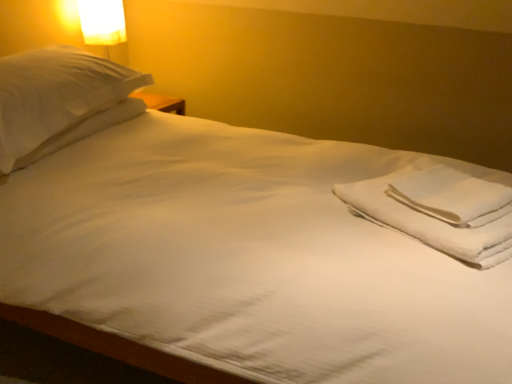
In the scene shown: What is the approximate width of matte white lampshade at upper left?

The width of matte white lampshade at upper left is 18.42 centimeters.

What do you see at coordinates (102, 22) in the screenshot? The height and width of the screenshot is (384, 512). I see `matte white lampshade at upper left` at bounding box center [102, 22].

The width and height of the screenshot is (512, 384). What are the coordinates of `white cotton towels at right` in the screenshot? It's located at coord(439,210).

Does matte white lampshade at upper left have a greater height compared to white soft pillow at upper left?

Indeed, matte white lampshade at upper left has a greater height compared to white soft pillow at upper left.

From the image's perspective, is matte white lampshade at upper left located above or below white soft pillow at upper left?

matte white lampshade at upper left is situated higher than white soft pillow at upper left in the image.

In the scene shown: In the image, is matte white lampshade at upper left positioned in front of or behind white soft pillow at upper left?

Visually, matte white lampshade at upper left is located behind white soft pillow at upper left.

How many degrees apart are the facing directions of matte white lampshade at upper left and white soft pillow at upper left?

The facing directions of matte white lampshade at upper left and white soft pillow at upper left are 130 degrees apart.

Is point (124, 75) behind point (123, 18)?

No, it is not.

From a real-world perspective, is white soft pillow at upper left above or below matte white lampshade at upper left?

white soft pillow at upper left is situated lower than matte white lampshade at upper left in the real world.

From the picture: Is white soft pillow at upper left at the left side of matte white lampshade at upper left?

No.

From the image's perspective, would you say white soft pillow at upper left is shown under matte white lampshade at upper left?

Indeed, from the image's perspective, white soft pillow at upper left is shown beneath matte white lampshade at upper left.

From the picture: Is white soft towel at right smaller than matte white lampshade at upper left?

Yes, white soft towel at right is smaller than matte white lampshade at upper left.

Between white soft towel at right and matte white lampshade at upper left, which one has less height?

With less height is white soft towel at right.

Is white soft towel at right not near matte white lampshade at upper left?

Indeed, white soft towel at right is not near matte white lampshade at upper left.

Which point is more distant from viewer, (454, 186) or (86, 20)?

The point (86, 20) is more distant.

Which is farther, (482, 187) or (132, 99)?

The point (132, 99) is farther.

Based on the photo, from the image's perspective, is white cotton towels at right positioned above or below white soft pillow at upper left?

From the image's perspective, white cotton towels at right appears below white soft pillow at upper left.

Could you tell me if white cotton towels at right is facing white soft pillow at upper left?

No, white cotton towels at right is not oriented towards white soft pillow at upper left.

Is white cotton towels at right far from white soft pillow at upper left?

Yes, white cotton towels at right is far from white soft pillow at upper left.

Is the position of white soft towel at right less distant than that of white soft pillow at upper left?

That is True.

Is white soft towel at right aimed at white soft pillow at upper left?

No, white soft towel at right does not turn towards white soft pillow at upper left.

Which of these two, white soft towel at right or white soft pillow at upper left, is thinner?

Thinner between the two is white soft towel at right.

Does point (463, 195) appear closer or farther from the camera than point (117, 4)?

Clearly, point (463, 195) is closer to the camera than point (117, 4).

Is white cotton towels at right bigger or smaller than matte white lampshade at upper left?

In the image, white cotton towels at right appears to be smaller than matte white lampshade at upper left.

Is white cotton towels at right facing towards matte white lampshade at upper left?

No, white cotton towels at right is not facing towards matte white lampshade at upper left.

From the image's perspective, which one is positioned higher, white cotton towels at right or matte white lampshade at upper left?

matte white lampshade at upper left appears higher in the image.

You are a GUI agent. You are given a task and a screenshot of the screen. Output one action in this format:
    pyautogui.click(x=<x>, y=<y>)
    Task: Click on the hand towel that is behind the white cotton towels at right
    Image resolution: width=512 pixels, height=384 pixels.
    Given the screenshot: What is the action you would take?
    pyautogui.click(x=452, y=196)

Does point (457, 204) lie in front of point (376, 221)?

Yes, point (457, 204) is closer to viewer.

From the image's perspective, is white soft towel at right located above or below white cotton towels at right?

white soft towel at right is above white cotton towels at right.

Who is taller, white soft towel at right or white cotton towels at right?

With more height is white cotton towels at right.

This screenshot has width=512, height=384. In order to click on pillow beneath the matte white lampshade at upper left (from a real-world perspective) in this screenshot , I will do `click(60, 101)`.

Where is `pillow in front of the matte white lampshade at upper left`? This screenshot has height=384, width=512. pillow in front of the matte white lampshade at upper left is located at coordinates (60, 101).

When comparing their distances from matte white lampshade at upper left, does white soft pillow at upper left or white soft towel at right seem closer?

The object closer to matte white lampshade at upper left is white soft pillow at upper left.

Based on their spatial positions, is white soft pillow at upper left or white soft towel at right closer to white cotton towels at right?

The object closer to white cotton towels at right is white soft towel at right.

Estimate the real-world distances between objects in this image. Which object is closer to white cotton towels at right, matte white lampshade at upper left or white soft towel at right?

white soft towel at right is positioned closer to the anchor white cotton towels at right.

Based on their spatial positions, is white soft pillow at upper left or white cotton towels at right further from matte white lampshade at upper left?

Based on the image, white cotton towels at right appears to be further to matte white lampshade at upper left.

Which object lies nearer to the anchor point white cotton towels at right, white soft pillow at upper left or matte white lampshade at upper left?

Based on the image, white soft pillow at upper left appears to be nearer to white cotton towels at right.

From the image, which object appears to be farther from matte white lampshade at upper left, white cotton towels at right or white soft towel at right?

white soft towel at right is further to matte white lampshade at upper left.

From the image, which object appears to be farther from matte white lampshade at upper left, white cotton towels at right or white soft pillow at upper left?

white cotton towels at right.

When comparing their distances from matte white lampshade at upper left, does white soft towel at right or white soft pillow at upper left seem closer?

Based on the image, white soft pillow at upper left appears to be nearer to matte white lampshade at upper left.

Where is `material located between matte white lampshade at upper left and white soft towel at right in the left-right direction`? The width and height of the screenshot is (512, 384). material located between matte white lampshade at upper left and white soft towel at right in the left-right direction is located at coordinates (439, 210).

The width and height of the screenshot is (512, 384). Find the location of `material situated between white soft pillow at upper left and white soft towel at right from left to right`. material situated between white soft pillow at upper left and white soft towel at right from left to right is located at coordinates (439, 210).

Find the location of a particular element. pillow between matte white lampshade at upper left and white cotton towels at right from left to right is located at coordinates (60, 101).

The height and width of the screenshot is (384, 512). Find the location of `pillow between matte white lampshade at upper left and white soft towel at right from left to right`. pillow between matte white lampshade at upper left and white soft towel at right from left to right is located at coordinates (60, 101).